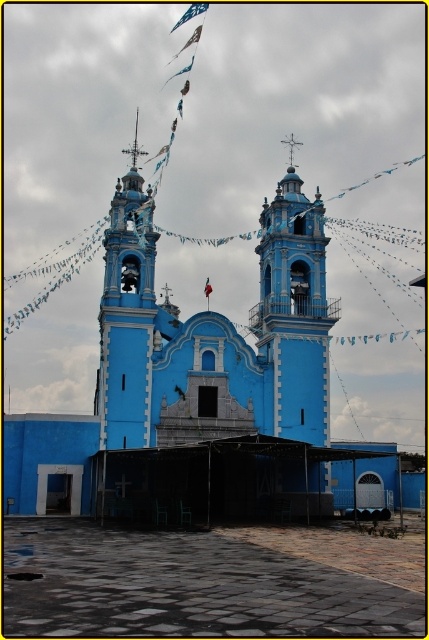
Question: Does blue painted stone church at center lie in front of matte blue bell tower at center?

Choices:
 (A) no
 (B) yes

Answer: (B)

Question: Among these points, which one is nearest to the camera?

Choices:
 (A) (114, 392)
 (B) (280, 310)

Answer: (A)

Question: Considering the relative positions of blue painted stone church at center and matte blue bell tower at center in the image provided, where is blue painted stone church at center located with respect to matte blue bell tower at center?

Choices:
 (A) right
 (B) left

Answer: (A)

Question: Does blue painted stone church at center appear on the left side of matte blue bell tower at center?

Choices:
 (A) yes
 (B) no

Answer: (B)

Question: Which point appears farthest from the camera in this image?

Choices:
 (A) (153, 300)
 (B) (18, 484)

Answer: (A)